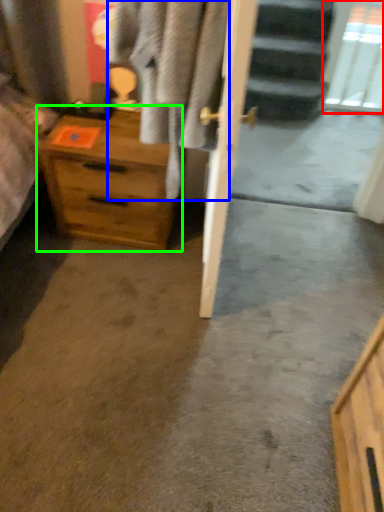
Question: Which object is the closest to the glass door (highlighted by a red box)? Choose among these: clothing (highlighted by a blue box) or chest of drawers (highlighted by a green box).

Choices:
 (A) clothing
 (B) chest of drawers

Answer: (B)